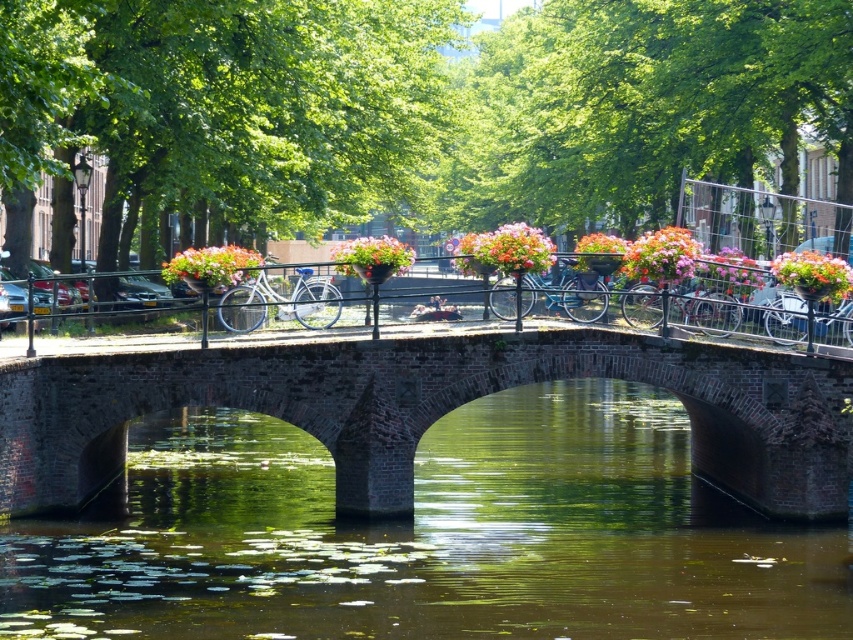
Question: Estimate the real-world distances between objects in this image. Which object is closer to the black metal railing at center?

Choices:
 (A) pink fabric flower at center
 (B) brick stone bridge at center
 (C) green leafy tree at center

Answer: (B)

Question: Which point is closer to the camera?

Choices:
 (A) (608, 106)
 (B) (672, 244)
 (C) (805, 262)

Answer: (B)

Question: Which point is closer to the camera?

Choices:
 (A) (675, 244)
 (B) (570, 310)
 (C) (599, 253)

Answer: (A)

Question: Does matte white bicycle at center have a lesser width compared to floral basket at center?

Choices:
 (A) yes
 (B) no

Answer: (A)

Question: Does shiny silver bicycle at center appear under vivid pink petals at upper right?

Choices:
 (A) no
 (B) yes

Answer: (B)

Question: Does green leafy tree at center have a lesser width compared to vibrant floral basket at center?

Choices:
 (A) yes
 (B) no

Answer: (B)